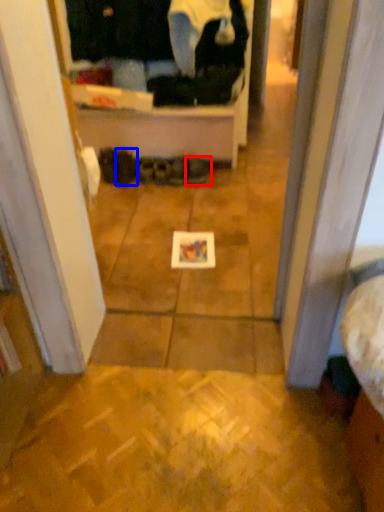
Question: Among these objects, which one is farthest to the camera, footwear (highlighted by a red box) or footwear (highlighted by a blue box)?

Choices:
 (A) footwear
 (B) footwear

Answer: (B)